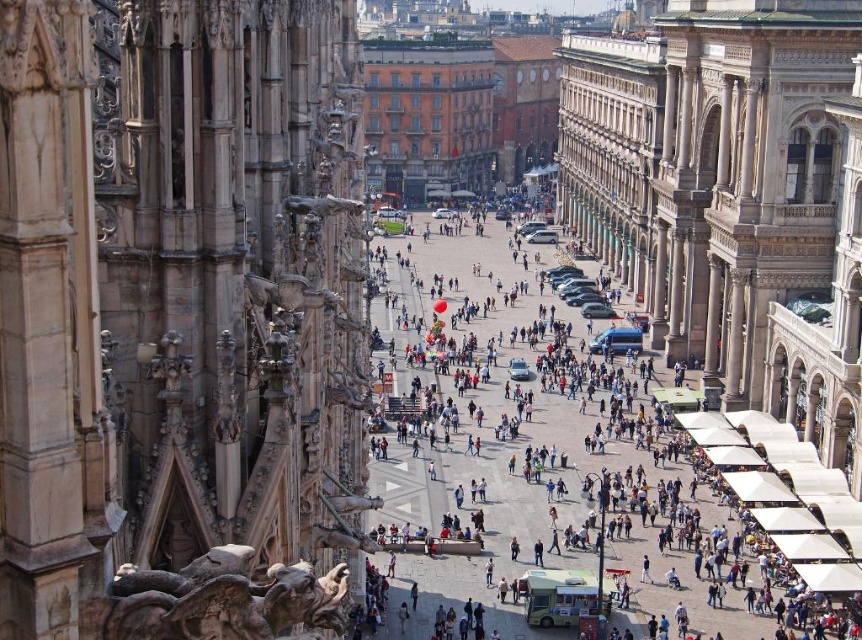
Question: Which of the following is the farthest from the observer?

Choices:
 (A) (67, 410)
 (B) (573, 515)

Answer: (B)

Question: Is beige stone gargoyle at left further to camera compared to matte white tent at center?

Choices:
 (A) no
 (B) yes

Answer: (A)

Question: Does beige stone gargoyle at left have a greater width compared to matte white tent at center?

Choices:
 (A) yes
 (B) no

Answer: (B)

Question: Among these points, which one is farthest from the camera?

Choices:
 (A) (98, 198)
 (B) (407, 280)

Answer: (B)

Question: Which point is farther from the camera taking this photo?

Choices:
 (A) (360, 410)
 (B) (398, 321)

Answer: (B)

Question: Considering the relative positions of beige stone gargoyle at left and matte white tent at center in the image provided, where is beige stone gargoyle at left located with respect to matte white tent at center?

Choices:
 (A) below
 (B) above

Answer: (B)